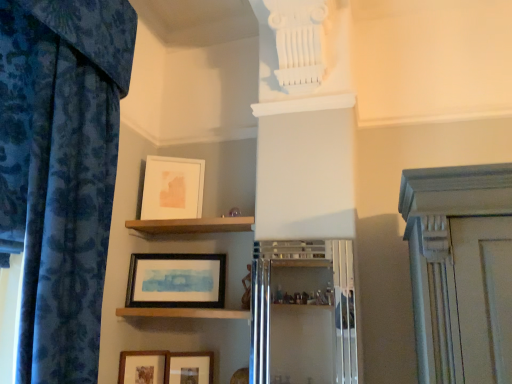
Question: Is the depth of black matte picture frame at lower center, the 3th picture frame ordered from the bottom, greater than that of wooden matte picture frame at lower left, the first picture frame when ordered from bottom to top?

Choices:
 (A) yes
 (B) no

Answer: (A)

Question: Is black matte picture frame at lower center, which is counted as the 2th picture frame, starting from the top, next to wooden matte picture frame at lower left, the 4th picture frame when ordered from top to bottom?

Choices:
 (A) no
 (B) yes

Answer: (A)

Question: Considering the relative positions of black matte picture frame at lower center, which is counted as the 2th picture frame, starting from the top, and wooden matte picture frame at lower left, the first picture frame when ordered from bottom to top, in the image provided, is black matte picture frame at lower center, which is counted as the 2th picture frame, starting from the top, in front of wooden matte picture frame at lower left, the first picture frame when ordered from bottom to top,?

Choices:
 (A) no
 (B) yes

Answer: (A)

Question: From the image's perspective, is black matte picture frame at lower center, the 3th picture frame ordered from the bottom, located beneath wooden matte picture frame at lower left, the 4th picture frame when ordered from top to bottom?

Choices:
 (A) no
 (B) yes

Answer: (A)

Question: Does black matte picture frame at lower center, the 3th picture frame ordered from the bottom, contain wooden matte picture frame at lower left, the first picture frame when ordered from bottom to top?

Choices:
 (A) no
 (B) yes

Answer: (A)

Question: Is wooden matte picture frame at lower left, the 4th picture frame when ordered from top to bottom, wider or thinner than metallic silver cabinet at center?

Choices:
 (A) wide
 (B) thin

Answer: (B)

Question: Is wooden matte picture frame at lower left, the 4th picture frame when ordered from top to bottom, situated inside metallic silver cabinet at center or outside?

Choices:
 (A) inside
 (B) outside

Answer: (B)

Question: Based on their sizes in the image, would you say wooden matte picture frame at lower left, the first picture frame when ordered from bottom to top, is bigger or smaller than metallic silver cabinet at center?

Choices:
 (A) big
 (B) small

Answer: (B)

Question: Is point (123, 370) closer or farther from the camera than point (287, 264)?

Choices:
 (A) closer
 (B) farther

Answer: (B)

Question: From the image's perspective, is matte white picture frame at upper center, which is the 1th picture frame from top to bottom, located above or below brown wooden shelf at upper center, which is counted as the 2th shelf, starting from the bottom?

Choices:
 (A) above
 (B) below

Answer: (A)

Question: Considering the positions of matte white picture frame at upper center, which is the 1th picture frame from top to bottom, and brown wooden shelf at upper center, which is counted as the 2th shelf, starting from the bottom, in the image, is matte white picture frame at upper center, which is the 1th picture frame from top to bottom, taller or shorter than brown wooden shelf at upper center, which is counted as the 2th shelf, starting from the bottom,?

Choices:
 (A) short
 (B) tall

Answer: (B)

Question: Looking at their shapes, would you say matte white picture frame at upper center, the fourth picture frame positioned from the bottom, is wider or thinner than brown wooden shelf at upper center, which is the first shelf in top-to-bottom order?

Choices:
 (A) thin
 (B) wide

Answer: (A)

Question: Considering the positions of matte white picture frame at upper center, the fourth picture frame positioned from the bottom, and brown wooden shelf at upper center, which is counted as the 2th shelf, starting from the bottom, in the image, is matte white picture frame at upper center, the fourth picture frame positioned from the bottom, bigger or smaller than brown wooden shelf at upper center, which is counted as the 2th shelf, starting from the bottom,?

Choices:
 (A) small
 (B) big

Answer: (A)

Question: Choose the correct answer: Is wooden shelf at center, arranged as the 2th shelf when viewed from the top, inside black matte picture frame at lower center, the 3th picture frame ordered from the bottom, or outside it?

Choices:
 (A) outside
 (B) inside

Answer: (A)

Question: Considering the positions of wooden shelf at center, arranged as the 2th shelf when viewed from the top, and black matte picture frame at lower center, which is counted as the 2th picture frame, starting from the top, in the image, is wooden shelf at center, arranged as the 2th shelf when viewed from the top, taller or shorter than black matte picture frame at lower center, which is counted as the 2th picture frame, starting from the top,?

Choices:
 (A) tall
 (B) short

Answer: (B)